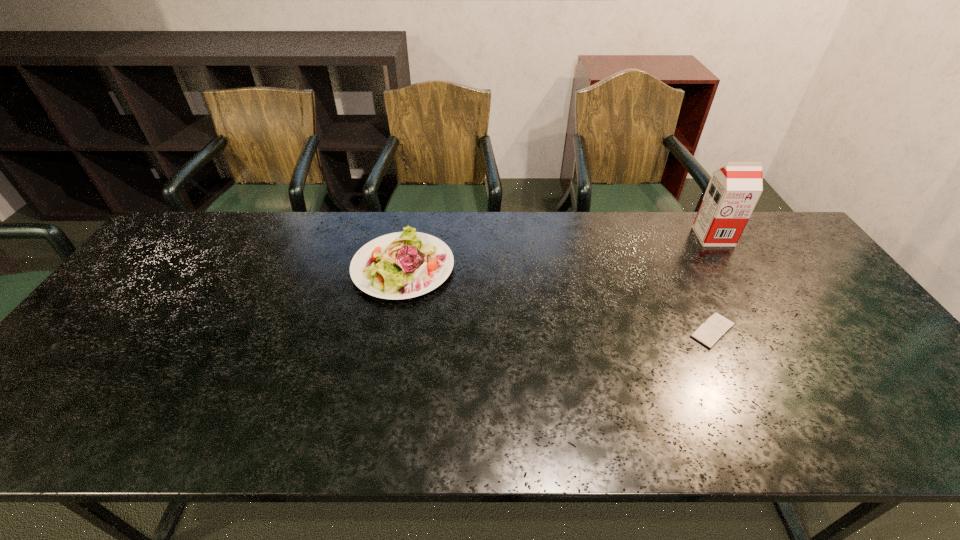
At what (x,y) coordinates should I click in order to perform the action: click on free point between the soya milk and the nearest object. Please return your answer as a coordinate pair (x, y). Image resolution: width=960 pixels, height=540 pixels. Looking at the image, I should click on (713, 284).

Locate an element on the screen. The height and width of the screenshot is (540, 960). empty space between the salad plate and the soya milk is located at coordinates (558, 252).

Where is `free point between the tallest object and the shortest object`? This screenshot has width=960, height=540. free point between the tallest object and the shortest object is located at coordinates (713, 284).

Where is `empty space that is in between the second object from right to left and the salad plate`? empty space that is in between the second object from right to left and the salad plate is located at coordinates (558, 299).

Image resolution: width=960 pixels, height=540 pixels. Find the location of `vacant area between the second object from left to right and the rightmost object`. vacant area between the second object from left to right and the rightmost object is located at coordinates tap(713, 284).

At what (x,y) coordinates should I click in order to perform the action: click on free spot between the nearest object and the second tallest object. Please return your answer as a coordinate pair (x, y). The image size is (960, 540). Looking at the image, I should click on [558, 299].

What are the coordinates of `object that is the closest to the rightmost object` in the screenshot? It's located at pos(709,333).

At what (x,y) coordinates should I click in order to perform the action: click on object that is the closest to the rightmost object. Please return your answer as a coordinate pair (x, y). The width and height of the screenshot is (960, 540). Looking at the image, I should click on (709, 333).

This screenshot has height=540, width=960. I want to click on free region that satisfies the following two spatial constraints: 1. on the front side of the diary; 2. on the right side of the second shortest object, so click(x=391, y=330).

At what (x,y) coordinates should I click in order to perform the action: click on free spot that satisfies the following two spatial constraints: 1. on the back side of the second tallest object; 2. on the left side of the tallest object. Please return your answer as a coordinate pair (x, y). This screenshot has height=540, width=960. Looking at the image, I should click on point(409,237).